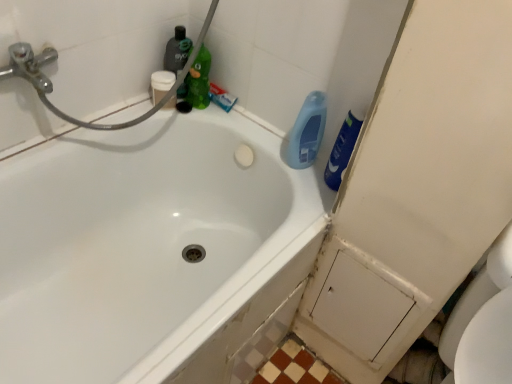
Question: From a real-world perspective, is white matte cup at upper left above or below white glossy bathtub at upper left?

Choices:
 (A) above
 (B) below

Answer: (A)

Question: Would you say white matte cup at upper left is inside or outside white glossy bathtub at upper left?

Choices:
 (A) outside
 (B) inside

Answer: (A)

Question: Which object is the farthest from the blue glossy bottle at upper right, acting as the 4th cleaning product starting from the left?

Choices:
 (A) blue glossy bottle at upper right, which appears as the third cleaning product when viewed from the left
 (B) blue matte toothpaste at upper center
 (C) green matte bottle at upper center, which is the 2th cleaning product from left to right
 (D) white matte cup at upper left
 (E) translucent green bottle at upper center, marked as the first cleaning product in a left-to-right arrangement

Answer: (D)

Question: Based on their relative distances, which object is farther from the white matte cup at upper left?

Choices:
 (A) blue glossy bottle at upper right, acting as the 4th cleaning product starting from the left
 (B) green matte bottle at upper center, the third cleaning product from the right
 (C) translucent green bottle at upper center, marked as the first cleaning product in a left-to-right arrangement
 (D) blue glossy bottle at upper right, which appears as the third cleaning product when viewed from the left
 (E) blue matte toothpaste at upper center

Answer: (A)